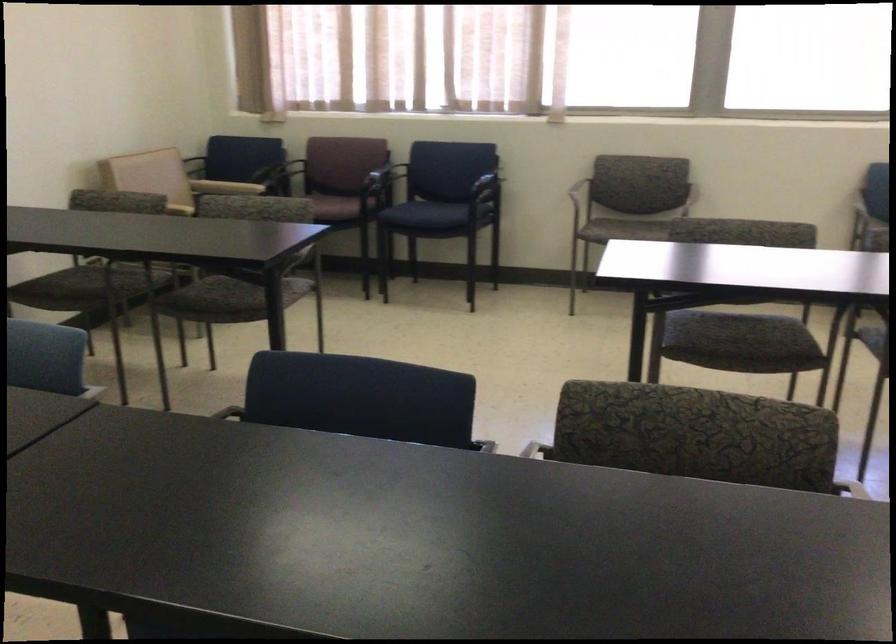
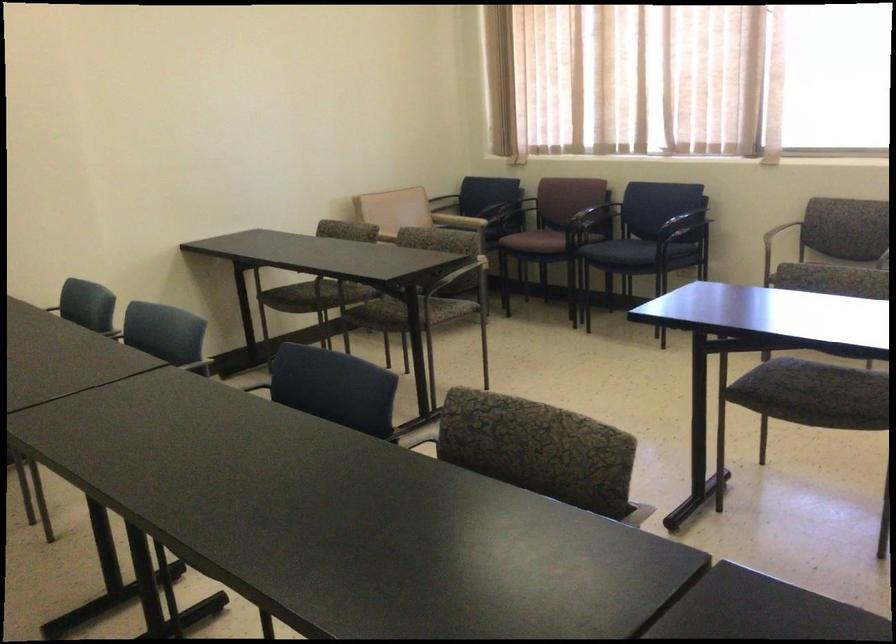
Where in the second image is the point corresponding to pixel 486 191 from the first image?

(687, 225)